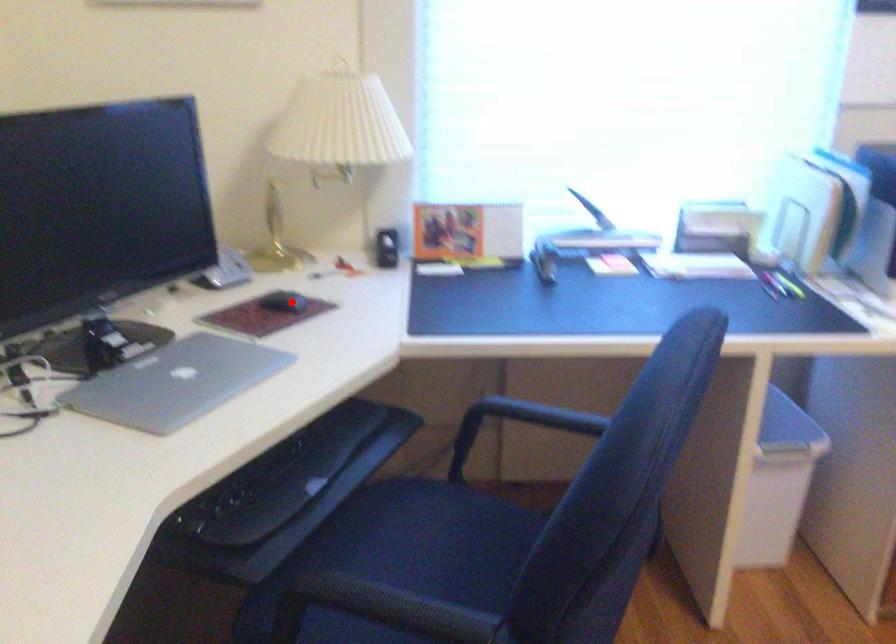
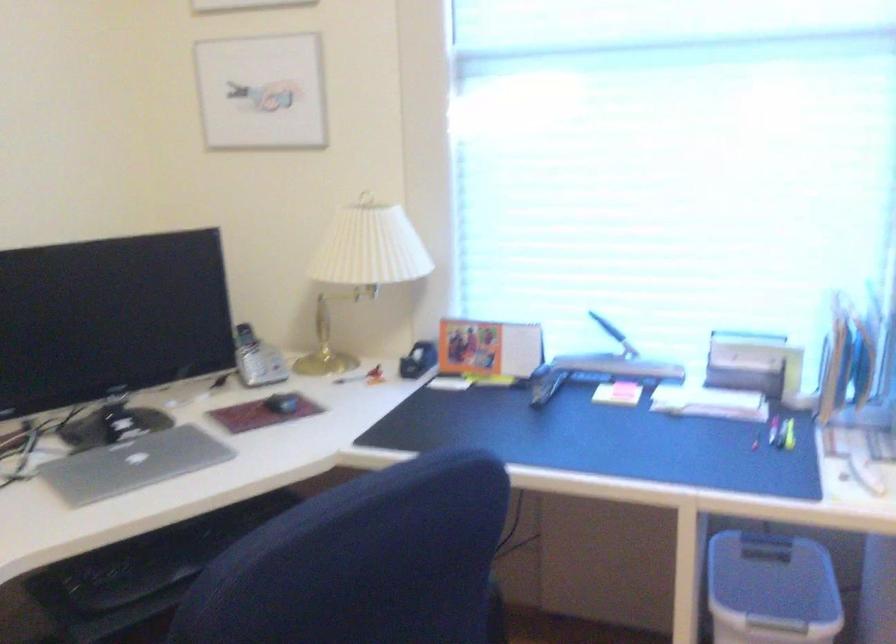
Where in the second image is the point corresponding to the highlighted location from the first image?

(281, 402)